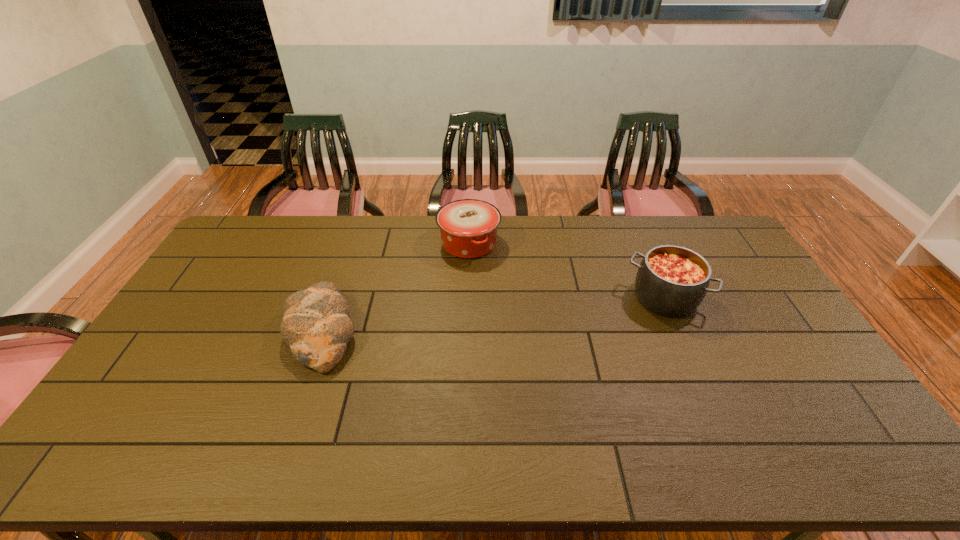
Locate an element on the screen. This screenshot has height=540, width=960. empty space between the shortest object and the left casserole is located at coordinates (396, 287).

Locate an element on the screen. vacant area between the rightmost object and the bread is located at coordinates (493, 315).

Locate an element on the screen. vacant space that is in between the bread and the nearer casserole is located at coordinates (493, 315).

Find the location of a particular element. vacant area that lies between the left casserole and the shortest object is located at coordinates [396, 287].

Find the location of a particular element. This screenshot has height=540, width=960. object that is the closest to the rightmost object is located at coordinates (468, 227).

Select which object is the closest to the right casserole. Please provide its 2D coordinates. Your answer should be formatted as a tuple, i.e. [(x, y)], where the tuple contains the x and y coordinates of a point satisfying the conditions above.

[(468, 227)]